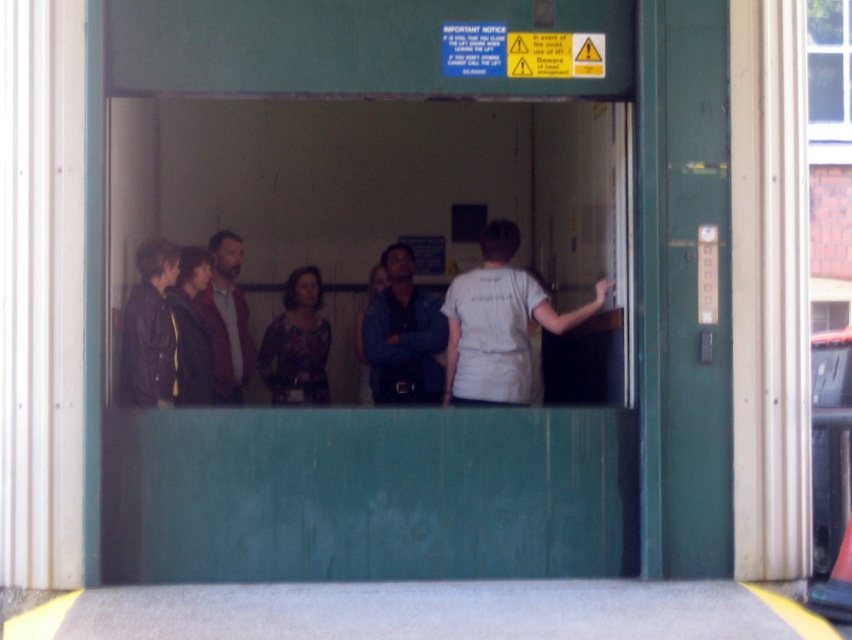
You are a maintenance worker in the elevator shaft. You need to reach the blue denim shirt at center and the printed fabric blouse at center to check their positions. Which one is higher up?

The blue denim shirt at center is above the printed fabric blouse at center, so the blue denim shirt at center is higher up.

You are a delivery robot with a box that is 5 feet long. You need to move through the elevator shaft where the white cotton shirt at center and the printed fabric blouse at center are standing. Can you fit your box between them without touching either?

The distance between the white cotton shirt at center and the printed fabric blouse at center is 6.18 feet. Since your box is 5 feet long, it can fit between them without touching either.

You are a photographer trying to capture a clear shot of both the white cotton shirt at center and the printed fabric blouse at center. Since they are both at the center, which one is more visible in the photo?

The white cotton shirt at center is positioned over the printed fabric blouse at center, so the white cotton shirt at center is more visible.